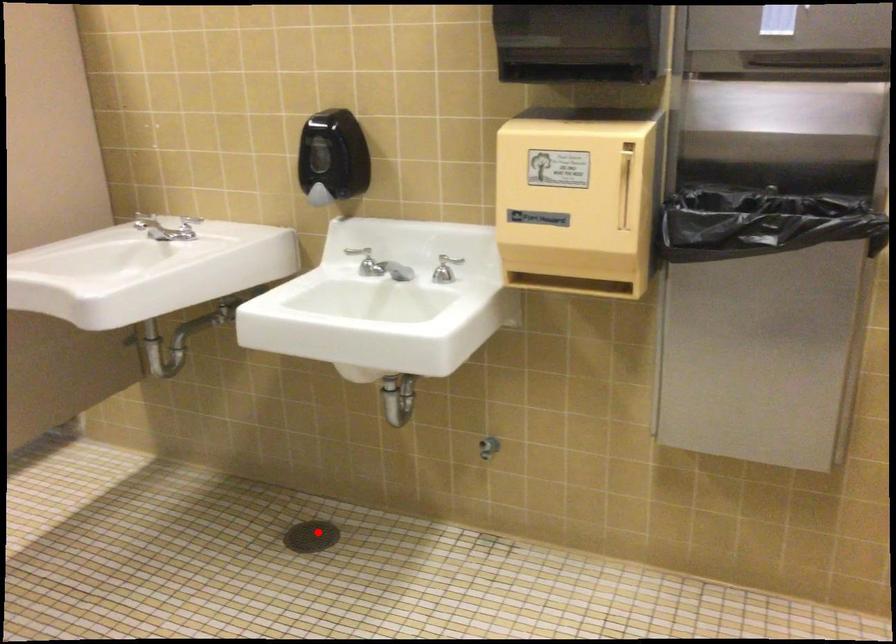
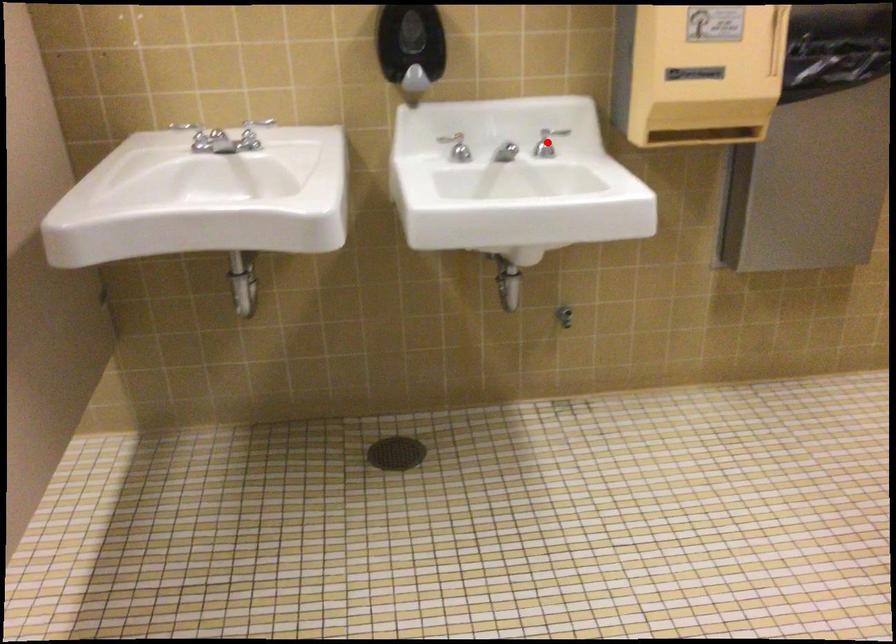
I am providing you with two images of the same scene from different viewpoints. A red point is marked on the first image and another point is marked on the second image. Are the points marked in image1 and image2 representing the same 3D position?

No